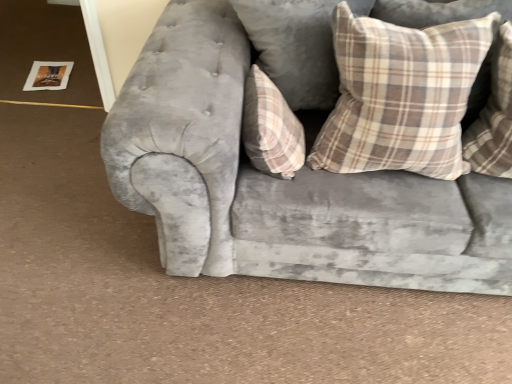
Question: Considering the relative positions of velvet gray couch at center and plaid fabric pillow at center, the third pillow viewed from the right, in the image provided, is velvet gray couch at center to the left or to the right of plaid fabric pillow at center, the third pillow viewed from the right,?

Choices:
 (A) left
 (B) right

Answer: (B)

Question: In terms of height, does velvet gray couch at center look taller or shorter compared to plaid fabric pillow at center, the third pillow viewed from the right?

Choices:
 (A) tall
 (B) short

Answer: (A)

Question: Based on their relative distances, which object is farther from the plaid fabric pillow at upper right, which ranks as the second pillow in right-to-left order?

Choices:
 (A) plaid fabric pillow at center, which is counted as the first pillow, starting from the left
 (B) plaid fabric pillow at upper right, which ranks as the 1th pillow in right-to-left order
 (C) velvet gray couch at center

Answer: (A)

Question: Which is nearer to the plaid fabric pillow at upper right, the second pillow when ordered from left to right?

Choices:
 (A) velvet gray couch at center
 (B) plaid fabric pillow at center, the third pillow viewed from the right
 (C) plaid fabric pillow at upper right, which is the 3th pillow in left-to-right order

Answer: (A)